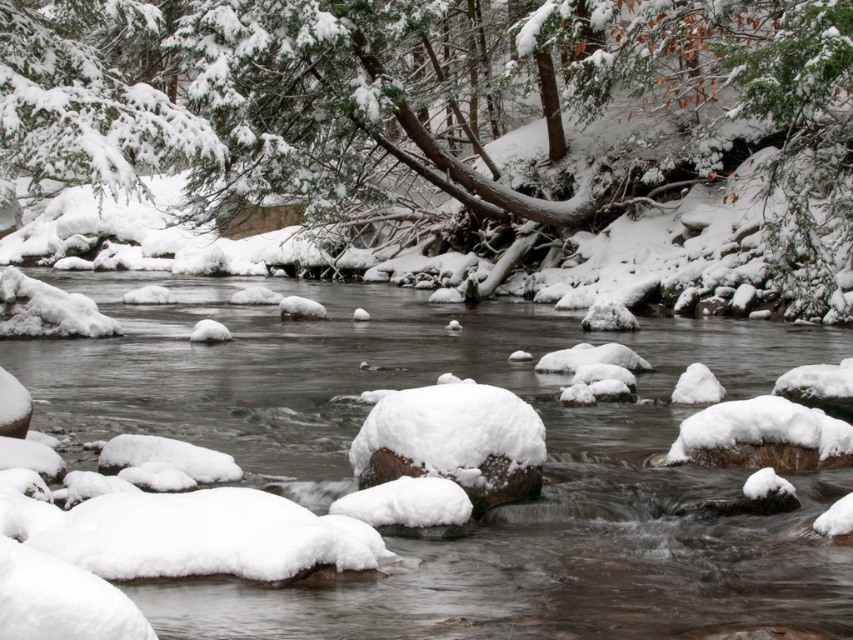
Question: Is green matte tree at center bigger than white snow-covered rocks at center?

Choices:
 (A) yes
 (B) no

Answer: (A)

Question: Which of the following is the closest to the observer?

Choices:
 (A) green matte tree at center
 (B) white snow-covered rocks at center
 (C) snow-covered rock at center

Answer: (B)

Question: Which object is positioned closest to the green matte tree at center?

Choices:
 (A) white snow-covered rocks at center
 (B) snow-covered rock at center

Answer: (A)

Question: Can you confirm if green matte tree at center is wider than white snow-covered rocks at center?

Choices:
 (A) no
 (B) yes

Answer: (B)

Question: Which of the following is the farthest from the observer?

Choices:
 (A) (564, 458)
 (B) (47, 128)
 (C) (480, 449)

Answer: (A)

Question: Is green matte tree at center closer to camera compared to white snow-covered rocks at center?

Choices:
 (A) no
 (B) yes

Answer: (A)